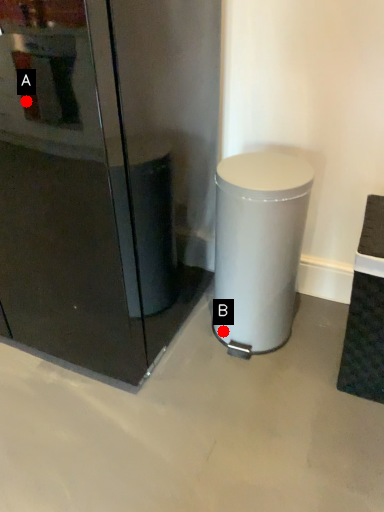
Question: Two points are circled on the image, labeled by A and B beside each circle. Which of the following is the farthest from the observer?

Choices:
 (A) A is further
 (B) B is further

Answer: (B)